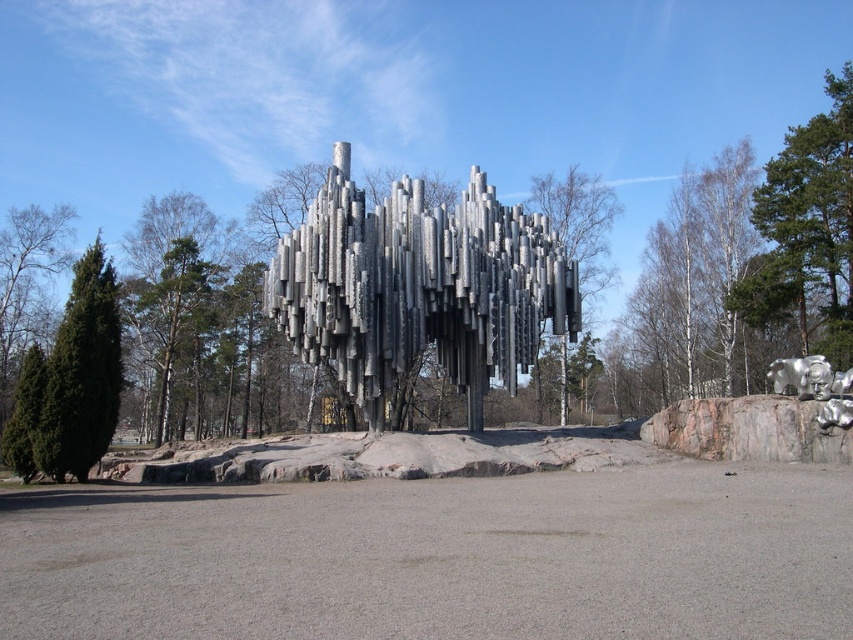
Is green leafy tree at left taller than white bark tree at center?

No.

Can you confirm if green leafy tree at left is smaller than white bark tree at center?

Correct, green leafy tree at left occupies less space than white bark tree at center.

What do you see at coordinates (28, 284) in the screenshot? This screenshot has height=640, width=853. I see `green leafy tree at left` at bounding box center [28, 284].

Image resolution: width=853 pixels, height=640 pixels. I want to click on green leafy tree at left, so click(28, 284).

Which is more to the right, green pine tree at right or white bark tree at center?

Positioned to the right is green pine tree at right.

Does green pine tree at right have a greater width compared to white bark tree at center?

Yes, green pine tree at right is wider than white bark tree at center.

The height and width of the screenshot is (640, 853). Describe the element at coordinates (807, 228) in the screenshot. I see `green pine tree at right` at that location.

Where is `green pine tree at right`? green pine tree at right is located at coordinates (807, 228).

Does point (358, 317) come behind point (843, 218)?

No, it is not.

Is polished metal sculpture at center to the right of green pine tree at right from the viewer's perspective?

No, polished metal sculpture at center is not to the right of green pine tree at right.

Locate an element on the screen. Image resolution: width=853 pixels, height=640 pixels. polished metal sculpture at center is located at coordinates (419, 288).